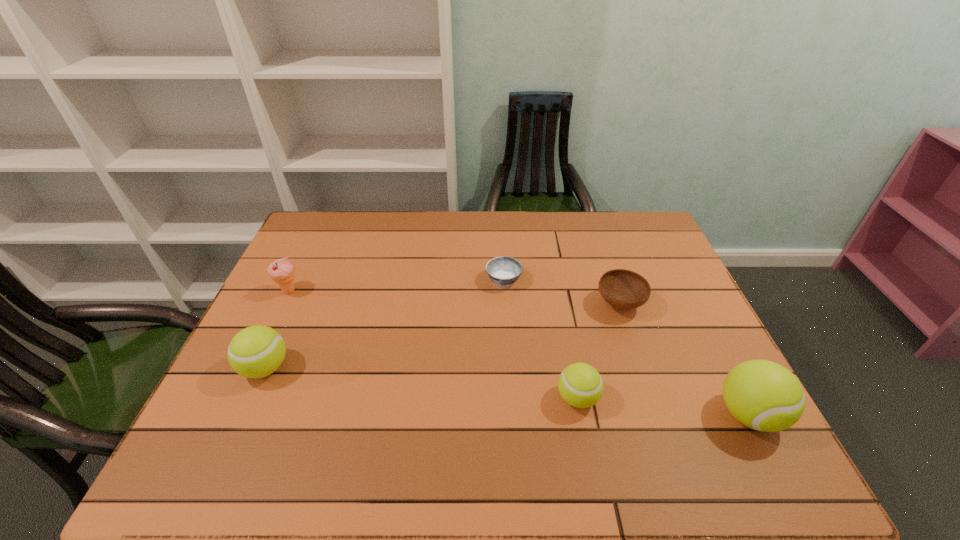
The height and width of the screenshot is (540, 960). I want to click on the second shortest tennis ball, so click(x=257, y=351).

Where is `the third object from right to left`? The height and width of the screenshot is (540, 960). the third object from right to left is located at coordinates (580, 385).

Locate an element on the screen. This screenshot has height=540, width=960. the third shortest object is located at coordinates (580, 385).

Where is `the rightmost tennis ball`? The image size is (960, 540). the rightmost tennis ball is located at coordinates (765, 396).

The image size is (960, 540). I want to click on the tallest tennis ball, so click(765, 396).

At what (x,y) coordinates should I click in order to perform the action: click on ashtray. Please return your answer as a coordinate pair (x, y). The image size is (960, 540). Looking at the image, I should click on (503, 271).

Locate an element on the screen. The image size is (960, 540). the shortest object is located at coordinates (503, 271).

Where is `icecream`? The width and height of the screenshot is (960, 540). icecream is located at coordinates (282, 271).

Identify the location of bowl. The image size is (960, 540). (623, 289).

Locate an element on the screen. the fifth tallest object is located at coordinates tap(623, 289).